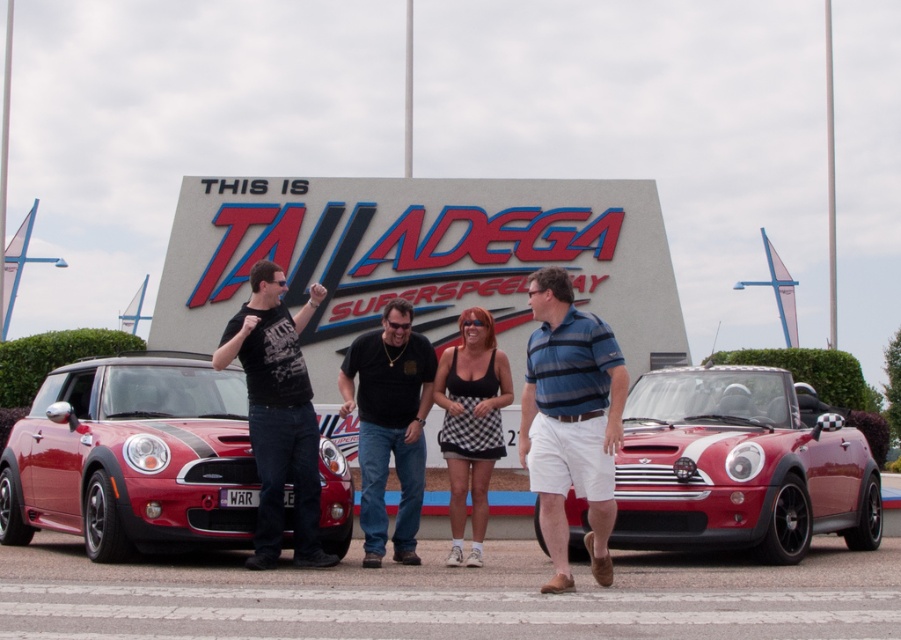
Measure the distance from shiny red convertible at center to black cotton t-shirt at center.

The distance of shiny red convertible at center from black cotton t-shirt at center is 12.35 feet.

Does shiny red convertible at center have a greater height compared to black cotton t-shirt at center?

No, shiny red convertible at center is not taller than black cotton t-shirt at center.

Does point (626, 470) come farther from viewer compared to point (290, 369)?

That is True.

Identify the location of shiny red convertible at center. This screenshot has height=640, width=901. (739, 467).

At what (x,y) coordinates should I click in order to perform the action: click on shiny red convertible at center. Please return your answer as a coordinate pair (x, y). The image size is (901, 640). Looking at the image, I should click on (739, 467).

Who is more distant from viewer, (775, 442) or (593, 552)?

Point (775, 442)

Where is `shiny red convertible at center`? Image resolution: width=901 pixels, height=640 pixels. shiny red convertible at center is located at coordinates (739, 467).

Between point (531, 408) and point (413, 502), which one is positioned in front?

Positioned in front is point (531, 408).

Is blue striped polo shirt at center shorter than black matte shirt at center?

Indeed, blue striped polo shirt at center has a lesser height compared to black matte shirt at center.

Which is behind, point (612, 369) or point (399, 454)?

The point (399, 454) is behind.

The image size is (901, 640). Find the location of `blue striped polo shirt at center`. blue striped polo shirt at center is located at coordinates [570, 420].